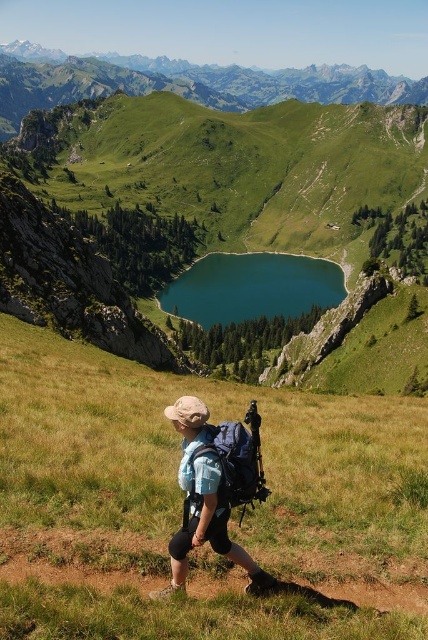
You are a hiker standing at point (241, 470) and want to reach the alpine lake in the midground. Is point (116, 90) located behind you or in front of you relative to your current position?

Point (116, 90) is behind point (241, 470), so if you are standing at point (241, 470) facing towards the alpine lake in the midground, point (116, 90) would be behind you.

You are a hiker standing at the trailhead looking towards the mountain. Which object is positioned to the left of the other between the green grassy mountain at upper center and the teal glossy water at center?

The green grassy mountain at upper center is positioned to the left of the teal glossy water at center.